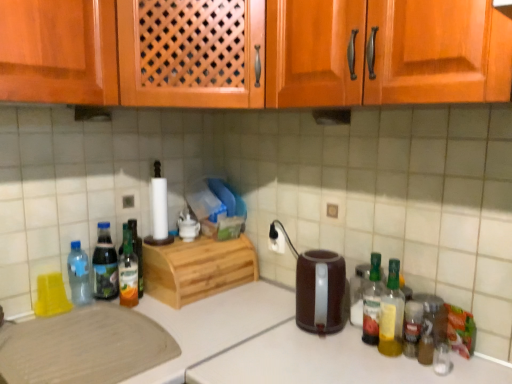
Question: From the image's perspective, would you say light brown wood cutting board at lower left is shown under translucent glass bottle at right, the third bottle from the right?

Choices:
 (A) no
 (B) yes

Answer: (B)

Question: Is light brown wood cutting board at lower left next to translucent glass bottle at right, which is counted as the fourth bottle, starting from the left, and touching it?

Choices:
 (A) no
 (B) yes

Answer: (A)

Question: From a real-world perspective, is light brown wood cutting board at lower left under translucent glass bottle at right, the third bottle from the right?

Choices:
 (A) yes
 (B) no

Answer: (A)

Question: Is light brown wood cutting board at lower left bigger than translucent glass bottle at right, which is counted as the fourth bottle, starting from the left?

Choices:
 (A) no
 (B) yes

Answer: (B)

Question: Is light brown wood cutting board at lower left far away from translucent glass bottle at right, which is counted as the fourth bottle, starting from the left?

Choices:
 (A) no
 (B) yes

Answer: (A)

Question: Is light brown wood cutting board at lower left oriented away from translucent glass bottle at right, the third bottle from the right?

Choices:
 (A) yes
 (B) no

Answer: (B)

Question: Can you confirm if light brown wood cutting board at lower left is positioned to the right of translucent plastic bottle at right, the sixth bottle viewed from the left?

Choices:
 (A) no
 (B) yes

Answer: (A)

Question: Is light brown wood cutting board at lower left next to translucent plastic bottle at right, the sixth bottle viewed from the left, and touching it?

Choices:
 (A) no
 (B) yes

Answer: (A)

Question: From the image's perspective, is light brown wood cutting board at lower left located beneath translucent plastic bottle at right, the sixth bottle viewed from the left?

Choices:
 (A) no
 (B) yes

Answer: (B)

Question: Can you confirm if light brown wood cutting board at lower left is positioned to the left of translucent plastic bottle at right, the first bottle when ordered from right to left?

Choices:
 (A) no
 (B) yes

Answer: (B)

Question: Is light brown wood cutting board at lower left positioned with its back to translucent plastic bottle at right, the sixth bottle viewed from the left?

Choices:
 (A) yes
 (B) no

Answer: (B)

Question: From a real-world perspective, is light brown wood cutting board at lower left under translucent plastic bottle at right, the sixth bottle viewed from the left?

Choices:
 (A) yes
 (B) no

Answer: (A)

Question: Is there a large distance between translucent plastic bottle at right, the first bottle when ordered from right to left, and translucent plastic bottle at left, which ranks as the second bottle in left-to-right order?

Choices:
 (A) no
 (B) yes

Answer: (A)